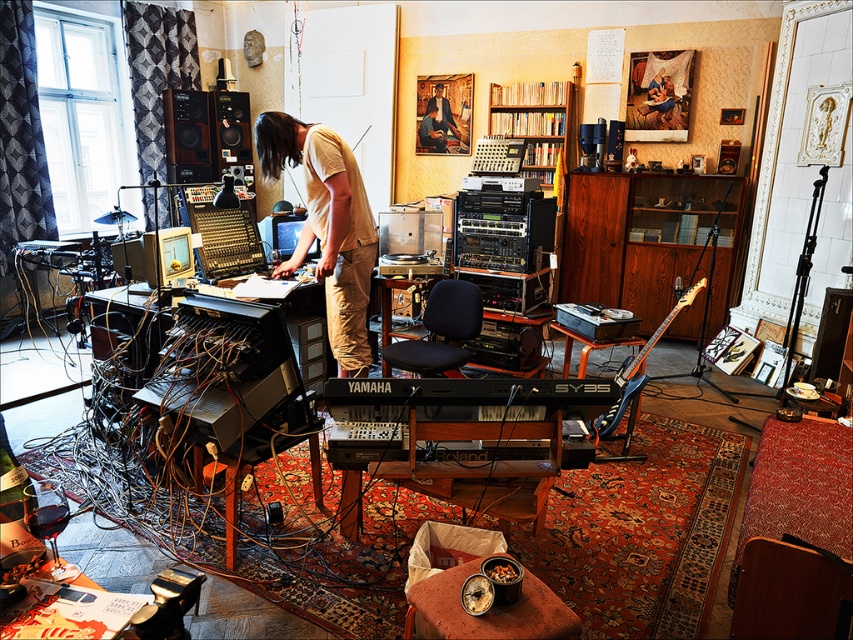
Based on the photo, can you confirm if light beige cotton shirt at center is shorter than black matte speaker at upper left?

No.

Which of these two, light beige cotton shirt at center or black matte speaker at upper left, stands taller?

light beige cotton shirt at center

Is point (366, 355) in front of point (222, 109)?

Yes, point (366, 355) is in front of point (222, 109).

Where is `light beige cotton shirt at center`? The height and width of the screenshot is (640, 853). light beige cotton shirt at center is located at coordinates (328, 227).

Between point (263, 128) and point (552, 128), which one is positioned behind?

Point (552, 128)

In the scene shown: Can you confirm if light beige cotton shirt at center is positioned above wooden bookshelf at center?

No.

The width and height of the screenshot is (853, 640). What do you see at coordinates (328, 227) in the screenshot?
I see `light beige cotton shirt at center` at bounding box center [328, 227].

The image size is (853, 640). What are the coordinates of `light beige cotton shirt at center` in the screenshot? It's located at (328, 227).

Between wooden bookshelf at center and smooth beige shirt at center, which one has more height?

wooden bookshelf at center

Does wooden bookshelf at center lie behind smooth beige shirt at center?

No, wooden bookshelf at center is closer to the viewer.

This screenshot has width=853, height=640. In order to click on wooden bookshelf at center in this screenshot , I will do `click(537, 125)`.